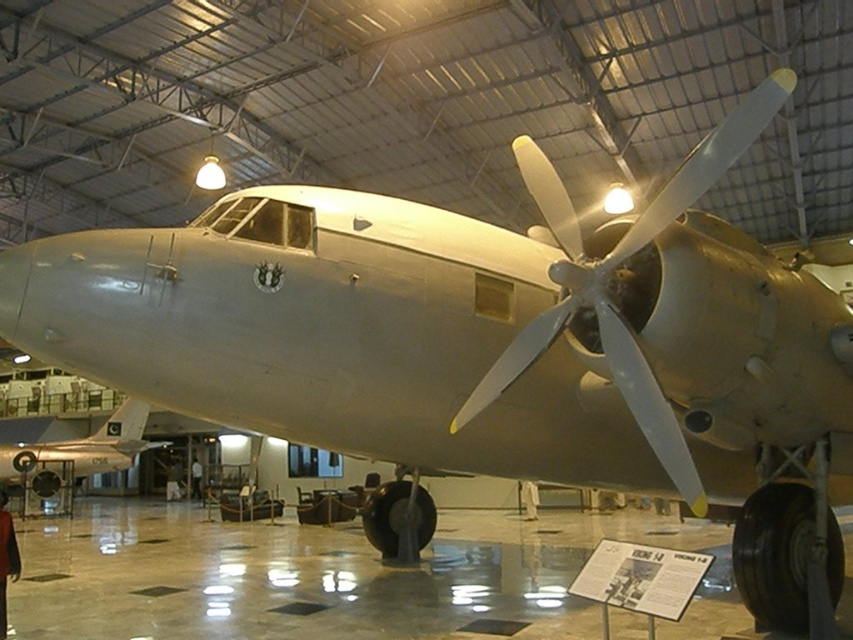
Question: Which point is farther to the camera?

Choices:
 (A) metallic silver propeller at center
 (B) metallic silver airplane at lower left
 (C) dark brown leather jacket at lower left

Answer: (B)

Question: Which point appears closest to the camera in this image?

Choices:
 (A) (566, 214)
 (B) (7, 573)
 (C) (78, 452)
 (D) (169, 497)

Answer: (A)

Question: Does brown fabric bag at center have a greater width compared to black leather chair at center?

Choices:
 (A) yes
 (B) no

Answer: (A)

Question: Can you confirm if brown fabric bag at center is positioned above black leather chair at center?

Choices:
 (A) no
 (B) yes

Answer: (A)

Question: Among these objects, which one is farthest from the camera?

Choices:
 (A) metallic silver propeller at center
 (B) dark brown leather jacket at lower left

Answer: (B)

Question: Observing the image, what is the correct spatial positioning of metallic silver airplane at lower left in reference to brown fabric bag at center?

Choices:
 (A) left
 (B) right

Answer: (B)